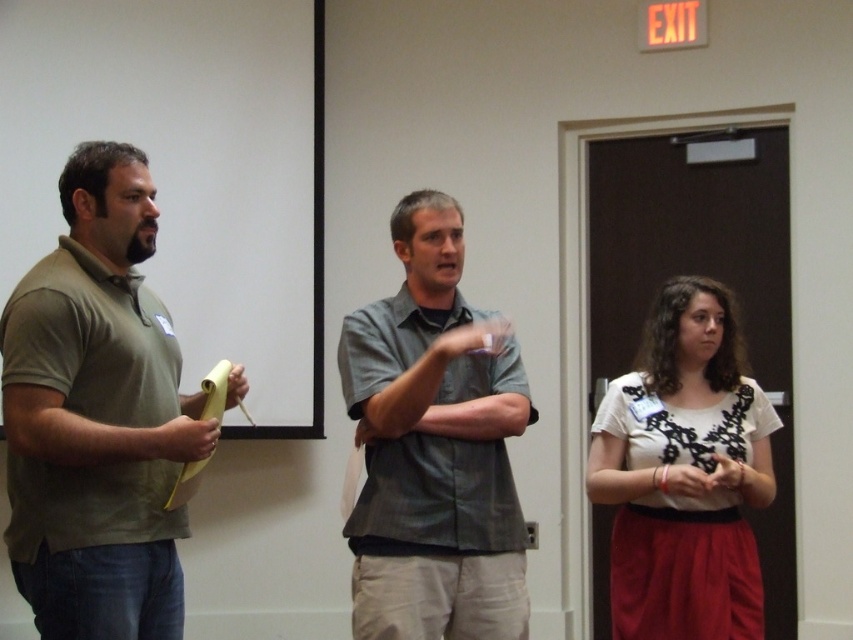
Which is more to the right, matte green polo shirt at left or white lace fabric at center?

Positioned to the right is white lace fabric at center.

Can you confirm if matte green polo shirt at left is bigger than white lace fabric at center?

No, matte green polo shirt at left is not bigger than white lace fabric at center.

Find the location of a particular element. The height and width of the screenshot is (640, 853). matte green polo shirt at left is located at coordinates (97, 417).

The height and width of the screenshot is (640, 853). I want to click on matte green polo shirt at left, so click(97, 417).

Between point (457, 499) and point (735, 326), which one is positioned in front?

Point (457, 499) is in front.

Is gray cotton shirt at center to the left of white lace fabric at center from the viewer's perspective?

Correct, you'll find gray cotton shirt at center to the left of white lace fabric at center.

Describe the element at coordinates (434, 445) in the screenshot. The height and width of the screenshot is (640, 853). I see `gray cotton shirt at center` at that location.

Where is `gray cotton shirt at center`? The height and width of the screenshot is (640, 853). gray cotton shirt at center is located at coordinates point(434,445).

Can you confirm if matte green polo shirt at left is thinner than gray cotton shirt at center?

Yes.

Which of these two, matte green polo shirt at left or gray cotton shirt at center, stands taller?

Standing taller between the two is matte green polo shirt at left.

Does point (20, 508) come closer to viewer compared to point (383, 563)?

Yes, point (20, 508) is in front of point (383, 563).

Identify the location of matte green polo shirt at left. Image resolution: width=853 pixels, height=640 pixels. (97, 417).